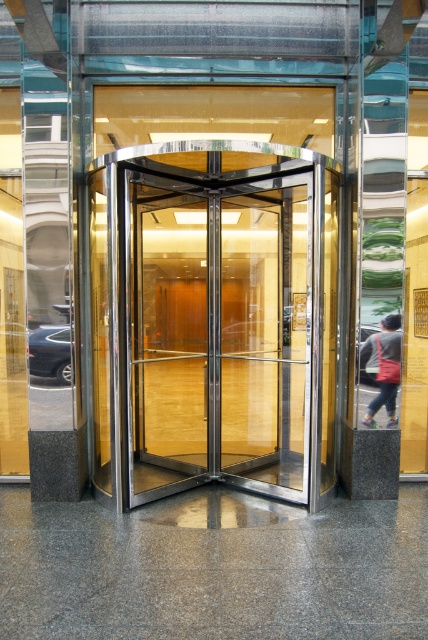
Can you confirm if transparent glass door at center is positioned below dark gray fabric jacket at right?

Actually, transparent glass door at center is above dark gray fabric jacket at right.

Between transparent glass door at center and dark gray fabric jacket at right, which one has more height?

Standing taller between the two is transparent glass door at center.

Between point (148, 380) and point (395, 323), which one is positioned in front?

Point (395, 323) is in front.

You are a GUI agent. You are given a task and a screenshot of the screen. Output one action in this format:
    pyautogui.click(x=<x>, y=<y>)
    Task: Click on the transparent glass door at center
    
    Given the screenshot: What is the action you would take?
    pyautogui.click(x=219, y=337)